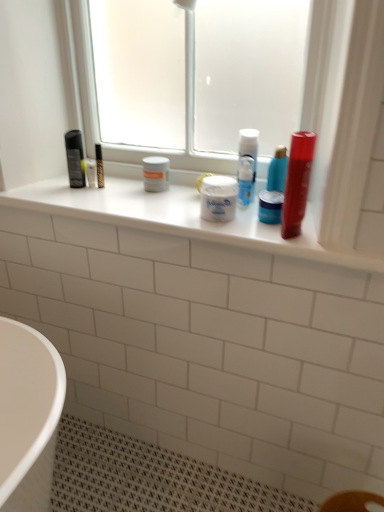
Question: Can you confirm if blue glossy jar at center, which ranks as the second mouthwash in front-to-back order, is positioned to the left of white plastic container at center?

Choices:
 (A) no
 (B) yes

Answer: (A)

Question: Does blue glossy jar at center, which ranks as the second mouthwash in front-to-back order, have a smaller size compared to white plastic container at center?

Choices:
 (A) yes
 (B) no

Answer: (A)

Question: From a real-world perspective, is blue glossy jar at center, which ranks as the second mouthwash in front-to-back order, located higher than white plastic container at center?

Choices:
 (A) yes
 (B) no

Answer: (A)

Question: Can white plastic container at center be found inside blue glossy jar at center, which ranks as the second mouthwash in front-to-back order?

Choices:
 (A) no
 (B) yes

Answer: (A)

Question: Is white plastic container at center at the back of blue glossy jar at center, which ranks as the second mouthwash in front-to-back order?

Choices:
 (A) no
 (B) yes

Answer: (A)

Question: From the image's perspective, relative to transparent frosted glass at upper center, is white plastic container at center above or below?

Choices:
 (A) below
 (B) above

Answer: (A)

Question: From a real-world perspective, is white plastic container at center physically located above or below transparent frosted glass at upper center?

Choices:
 (A) above
 (B) below

Answer: (B)

Question: Is white plastic container at center taller or shorter than transparent frosted glass at upper center?

Choices:
 (A) short
 (B) tall

Answer: (A)

Question: Choose the correct answer: Is white plastic container at center inside transparent frosted glass at upper center or outside it?

Choices:
 (A) inside
 (B) outside

Answer: (B)

Question: In the image, is white matte jar at center positioned in front of or behind white plastic container at center?

Choices:
 (A) behind
 (B) front

Answer: (A)

Question: Based on their sizes in the image, would you say white matte jar at center is bigger or smaller than white plastic container at center?

Choices:
 (A) big
 (B) small

Answer: (B)

Question: Is white matte jar at center to the left or to the right of white plastic container at center in the image?

Choices:
 (A) left
 (B) right

Answer: (B)

Question: Is white matte jar at center wider or thinner than white plastic container at center?

Choices:
 (A) thin
 (B) wide

Answer: (A)

Question: Is white matte jar at center to the left or to the right of blue glossy jar at center, which ranks as the second mouthwash in front-to-back order, in the image?

Choices:
 (A) right
 (B) left

Answer: (B)

Question: From a real-world perspective, is white matte jar at center physically located above or below blue glossy jar at center, the first mouthwash viewed from the back?

Choices:
 (A) above
 (B) below

Answer: (A)